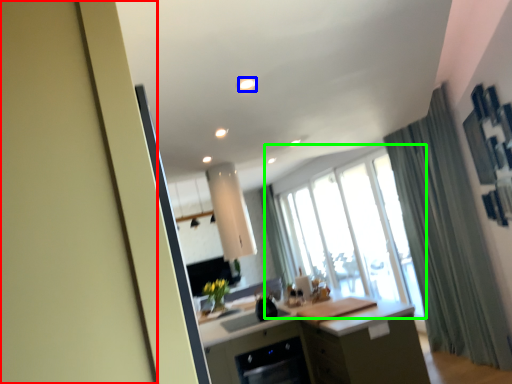
Question: Which is nearer to the screen door (highlighted by a red box)? light (highlighted by a blue box) or window (highlighted by a green box).

Choices:
 (A) light
 (B) window

Answer: (A)